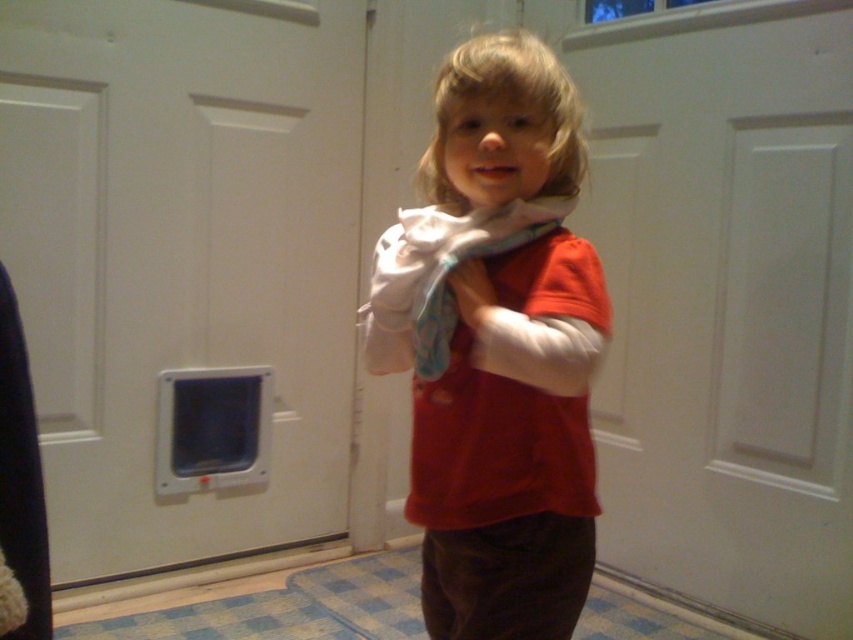
Question: Which object is farther from the camera taking this photo?

Choices:
 (A) matte red shirt at center
 (B) white soft scarf at center

Answer: (B)

Question: Does matte red shirt at center lie in front of white soft scarf at center?

Choices:
 (A) no
 (B) yes

Answer: (B)

Question: Is matte red shirt at center to the right of white soft scarf at center from the viewer's perspective?

Choices:
 (A) no
 (B) yes

Answer: (B)

Question: Is matte red shirt at center behind white soft scarf at center?

Choices:
 (A) no
 (B) yes

Answer: (A)